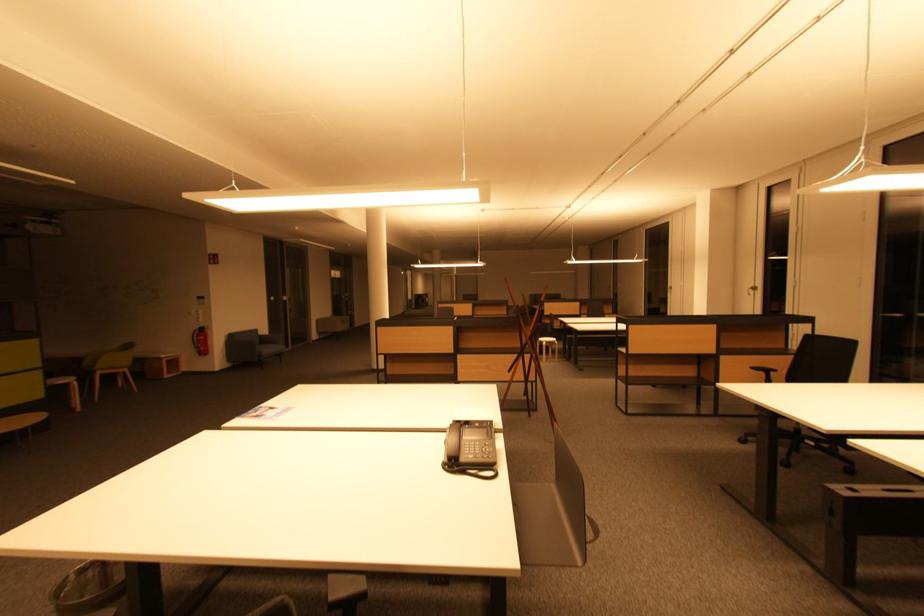
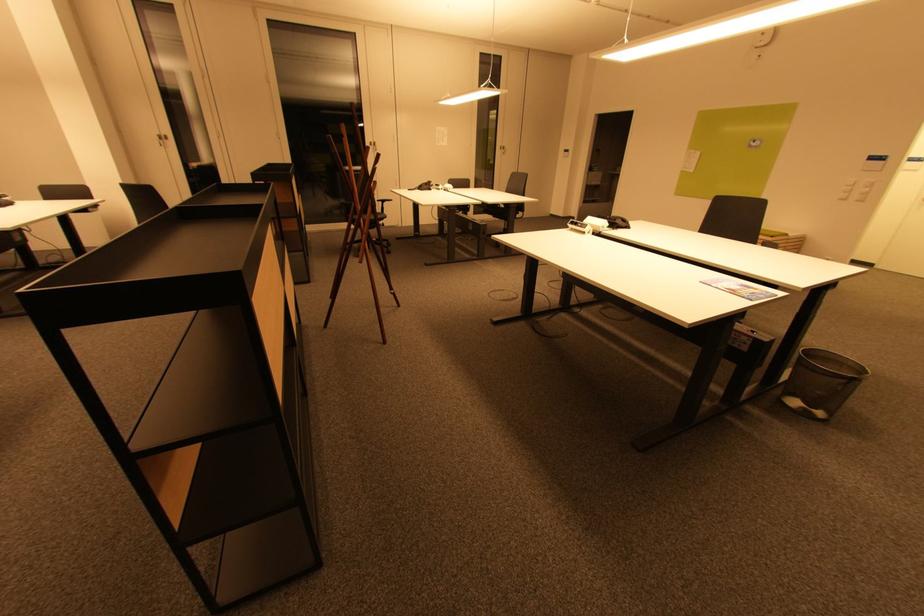
In the second image, find the point that corresponds to the point at 759,291 in the first image.

(166, 140)